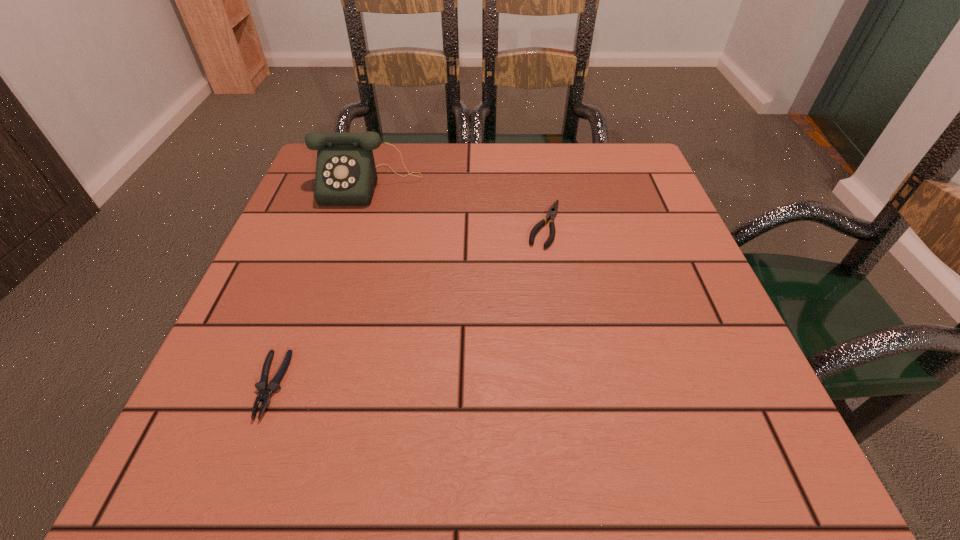
Where is `telephone`? telephone is located at coordinates (346, 175).

What are the coordinates of `the farther pliers` in the screenshot? It's located at (552, 212).

The width and height of the screenshot is (960, 540). Find the location of `the right pliers`. the right pliers is located at coordinates (552, 212).

The width and height of the screenshot is (960, 540). Find the location of `the left pliers`. the left pliers is located at coordinates (265, 390).

In order to click on the nearest object in this screenshot , I will do `click(265, 390)`.

The height and width of the screenshot is (540, 960). Identify the location of blank space located 0.080m on the dial of the tallest object. (355, 231).

Identify the location of vacant space located 0.090m on the front of the right pliers. The width and height of the screenshot is (960, 540). (555, 284).

This screenshot has height=540, width=960. Find the location of `vacant region located 0.080m at the gripping part of the left pliers`. vacant region located 0.080m at the gripping part of the left pliers is located at coordinates (235, 481).

Locate an element on the screen. The height and width of the screenshot is (540, 960). object at the far edge is located at coordinates (346, 175).

You are a GUI agent. You are given a task and a screenshot of the screen. Output one action in this format:
    pyautogui.click(x=<x>, y=<y>)
    Task: Click on the object that is positioned at the near edge
    This screenshot has width=960, height=540.
    Given the screenshot: What is the action you would take?
    pyautogui.click(x=265, y=390)